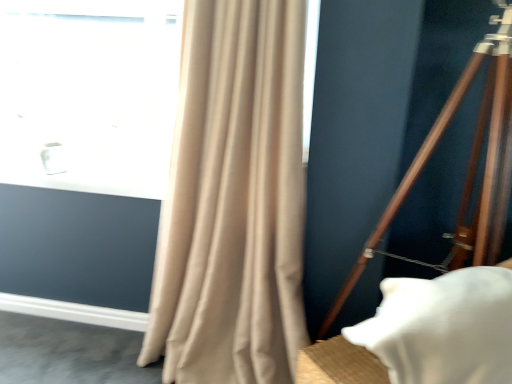
Question: Can you confirm if wooden tripod at right is positioned to the right of white matte pillow at lower right?

Choices:
 (A) yes
 (B) no

Answer: (A)

Question: Is wooden tripod at right taller than white matte pillow at lower right?

Choices:
 (A) yes
 (B) no

Answer: (A)

Question: Does wooden tripod at right have a lesser height compared to white matte pillow at lower right?

Choices:
 (A) no
 (B) yes

Answer: (A)

Question: Is white matte pillow at lower right completely or partially inside wooden tripod at right?

Choices:
 (A) no
 (B) yes

Answer: (A)

Question: Considering the relative sizes of wooden tripod at right and white matte pillow at lower right in the image provided, is wooden tripod at right bigger than white matte pillow at lower right?

Choices:
 (A) no
 (B) yes

Answer: (B)

Question: Does point (446, 299) appear closer or farther from the camera than point (253, 172)?

Choices:
 (A) farther
 (B) closer

Answer: (B)

Question: From a real-world perspective, is white matte pillow at lower right physically located above or below beige fabric curtain at left?

Choices:
 (A) above
 (B) below

Answer: (B)

Question: Is white matte pillow at lower right taller or shorter than beige fabric curtain at left?

Choices:
 (A) tall
 (B) short

Answer: (B)

Question: Is white matte pillow at lower right to the left or to the right of beige fabric curtain at left in the image?

Choices:
 (A) left
 (B) right

Answer: (B)

Question: From the image's perspective, is wooden tripod at right positioned above or below beige fabric curtain at left?

Choices:
 (A) below
 (B) above

Answer: (A)

Question: Considering the positions of point (504, 117) and point (264, 67), is point (504, 117) closer or farther from the camera than point (264, 67)?

Choices:
 (A) farther
 (B) closer

Answer: (B)

Question: From a real-world perspective, relative to beige fabric curtain at left, is wooden tripod at right vertically above or below?

Choices:
 (A) above
 (B) below

Answer: (A)

Question: In terms of height, does wooden tripod at right look taller or shorter compared to beige fabric curtain at left?

Choices:
 (A) short
 (B) tall

Answer: (B)

Question: Is wooden tripod at right inside the boundaries of white matte pillow at lower right, or outside?

Choices:
 (A) outside
 (B) inside

Answer: (A)

Question: Looking at the image, does wooden tripod at right seem bigger or smaller compared to white matte pillow at lower right?

Choices:
 (A) small
 (B) big

Answer: (B)